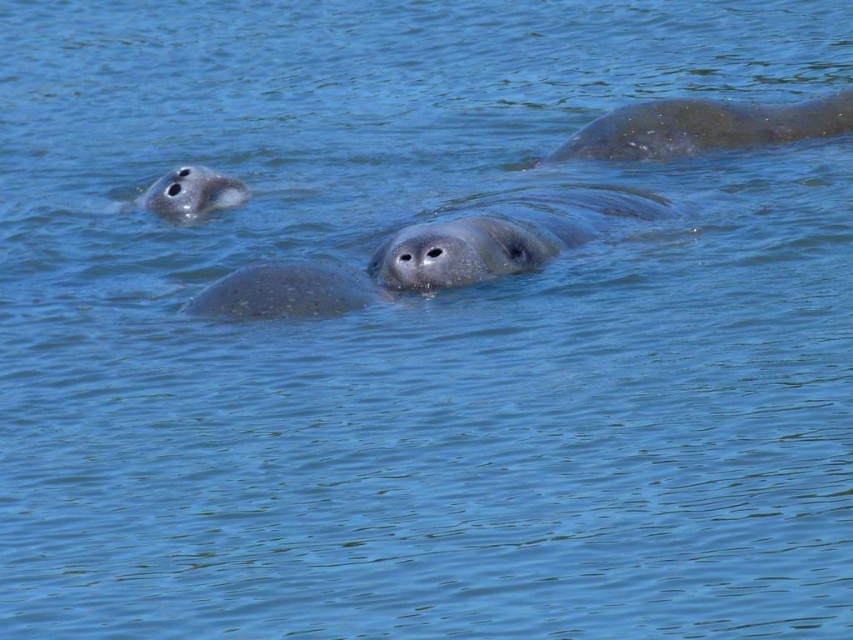
You are a marine biologist observing the aquatic scene. You need to determine if a 1.2 meter wide research buoy can fit between the gray matte seal at upper right and the smooth gray seal at center without disturbing them. Can it fit?

The gray matte seal at upper right might be wider than smooth gray seal at center, so the space between them may not be sufficient for the 1.2 meter wide research buoy. Further measurement is needed to confirm.

You are a marine biologist observing the gray matte seal at center and the gray matte seal at upper left in the water. Which seal has a larger vertical dimension?

The gray matte seal at center has a greater height compared to the gray matte seal at upper left, so it has a larger vertical dimension.

Based on the photo, you are observing two seals in the water. There is a gray matte seal at center and a smooth gray seal at center. Which seal is positioned more to the right?

The gray matte seal at center is positioned more to the right than the smooth gray seal at center.